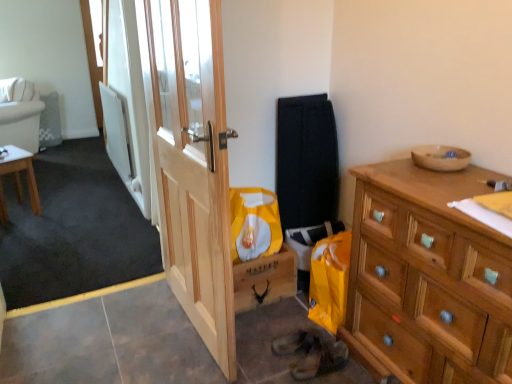
The image size is (512, 384). What are the coordinates of `vacant space positioned to the left of leather shoe at lower center` in the screenshot? It's located at (265, 359).